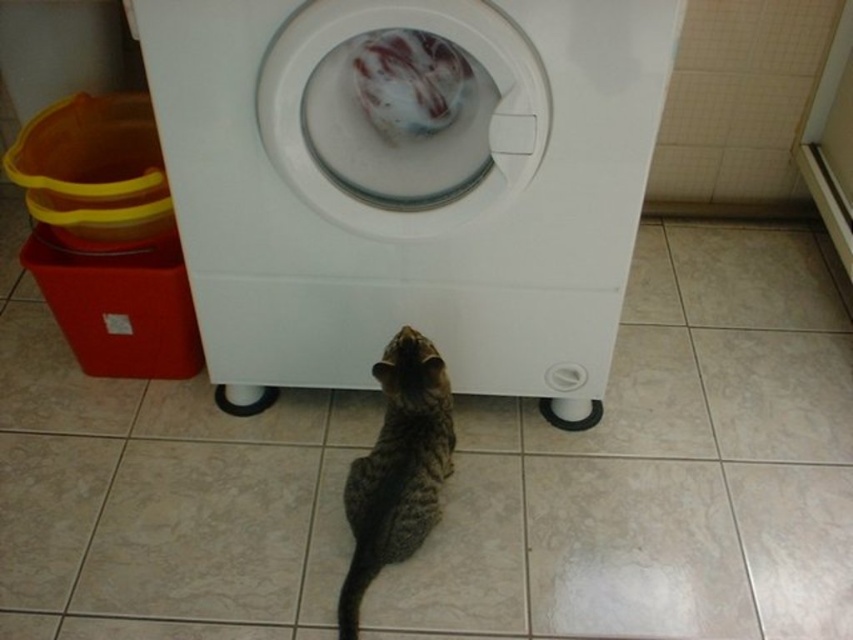
What object is located at the coordinates point (408, 182) in the image?

The point (408, 182) indicates the white plastic washing machine at center.

You are standing in the laundry room and want to reach the point marked at coordinates (202, 250). If your arm can extend 1.2 meters, will you be able to reach it without moving?

The distance between the point marked at coordinates (202, 250) and the camera is 1.27 meters. Since your arm can only extend 1.2 meters, you will not be able to reach it without moving.

You are moving a 36 inch wide box from the doorway to the left side of the room. You need to pass between the white plastic washing machine at center and the two stacked plastic containers to the left. Will the box fit through the space between them?

The space between the white plastic washing machine at center and the two stacked plastic containers to the left is 37.71 inches. Since the box is 36 inches wide, it will fit through the space as it is wider than the box.